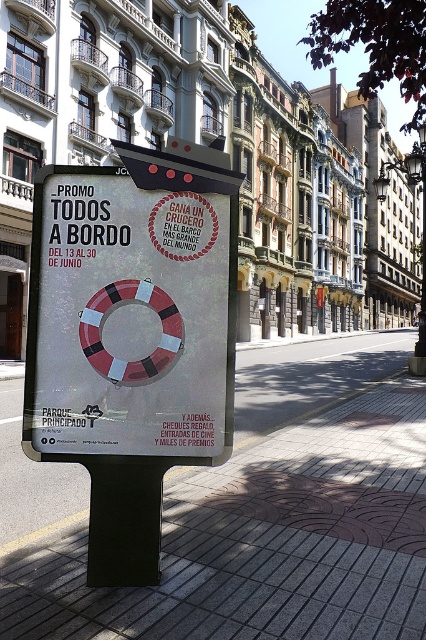
Question: Does brick pavement at center have a greater width compared to white paper lifebuoy at center?

Choices:
 (A) no
 (B) yes

Answer: (B)

Question: Which object appears closest to the camera in this image?

Choices:
 (A) brick pavement at center
 (B) white paper lifebuoy at center

Answer: (A)

Question: Which point is farther to the camera?

Choices:
 (A) pyautogui.click(x=310, y=484)
 (B) pyautogui.click(x=103, y=172)

Answer: (A)

Question: Is brick pavement at center positioned before white paper lifebuoy at center?

Choices:
 (A) yes
 (B) no

Answer: (A)

Question: Which object is farther from the camera taking this photo?

Choices:
 (A) white paper lifebuoy at center
 (B) brick pavement at center

Answer: (A)

Question: Where is brick pavement at center located in relation to white paper lifebuoy at center in the image?

Choices:
 (A) below
 (B) above

Answer: (A)